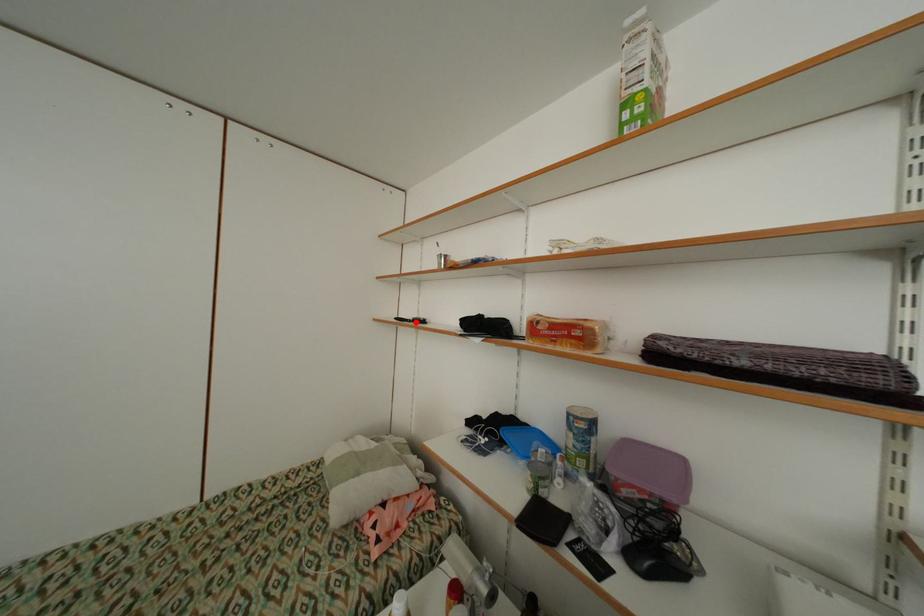
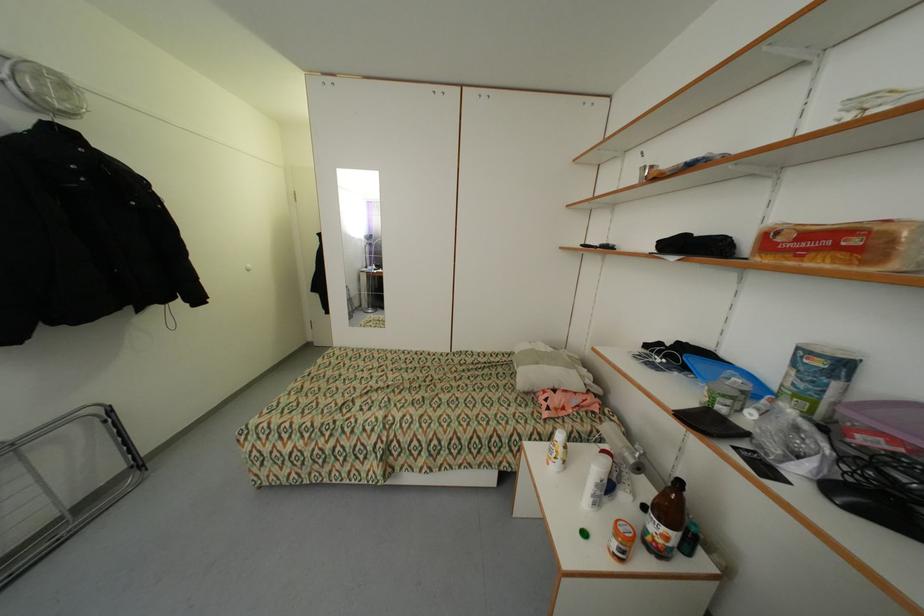
Find the pixel in the second image that matches the highlighted location in the first image.

(602, 248)